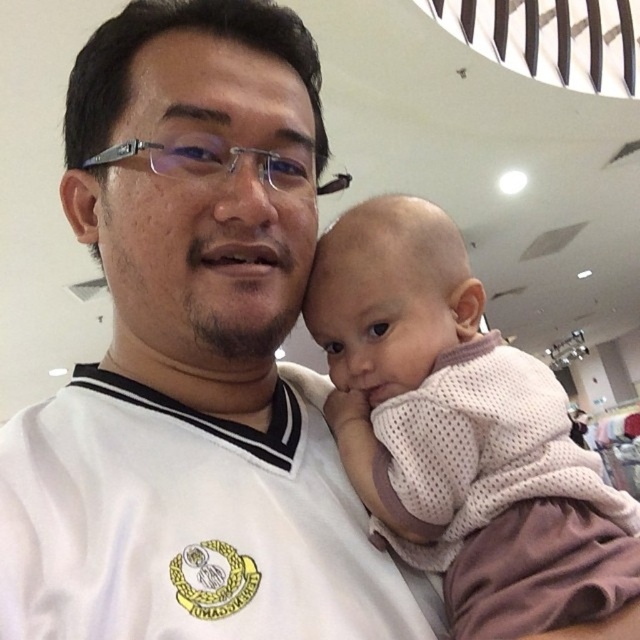
Question: Is white mesh shirt at center above pink mesh shirt at center?

Choices:
 (A) no
 (B) yes

Answer: (B)

Question: Does white mesh shirt at center appear on the right side of pink mesh shirt at center?

Choices:
 (A) yes
 (B) no

Answer: (B)

Question: Is white mesh shirt at center closer to the viewer compared to pink mesh shirt at center?

Choices:
 (A) yes
 (B) no

Answer: (A)